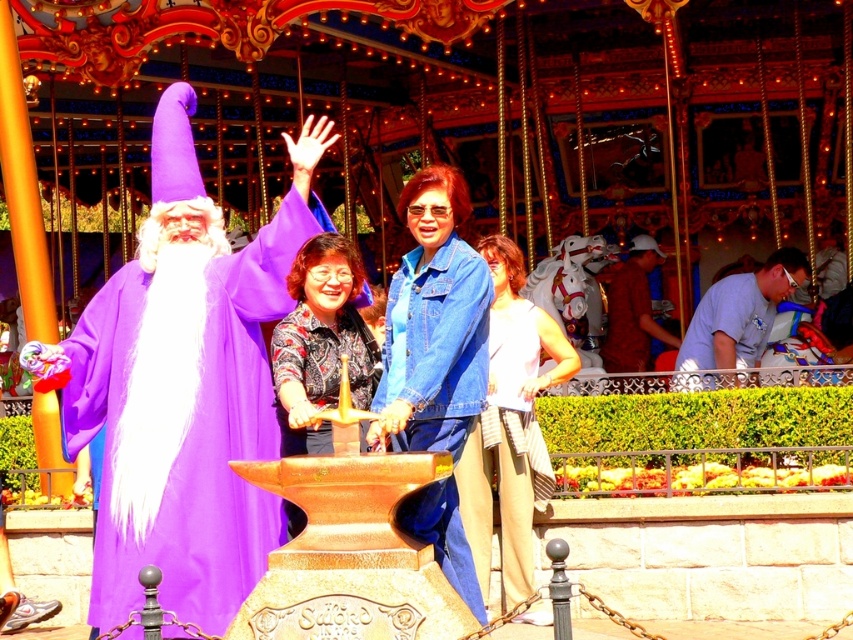
Is white cotton tank top at center further to camera compared to light blue denim shirt at right?

That is False.

Is point (490, 316) closer to viewer compared to point (767, 308)?

That is True.

Does point (531, 388) come closer to viewer compared to point (741, 324)?

Yes.

This screenshot has width=853, height=640. Find the location of `white cotton tank top at center`. white cotton tank top at center is located at coordinates (509, 426).

Can you confirm if denim jacket at center is positioned to the left of brown fabric shirt at center?

Indeed, denim jacket at center is positioned on the left side of brown fabric shirt at center.

Which is in front, point (430, 442) or point (647, 344)?

Point (430, 442)

What do you see at coordinates (433, 324) in the screenshot?
I see `denim jacket at center` at bounding box center [433, 324].

You are a GUI agent. You are given a task and a screenshot of the screen. Output one action in this format:
    pyautogui.click(x=<x>, y=<y>)
    Task: Click on the denim jacket at center
    This screenshot has height=640, width=853.
    Given the screenshot: What is the action you would take?
    pyautogui.click(x=433, y=324)

Which is behind, point (234, 388) or point (457, 273)?

Positioned behind is point (234, 388).

What do you see at coordinates (184, 385) in the screenshot? Image resolution: width=853 pixels, height=640 pixels. I see `purple velvet wizard at left` at bounding box center [184, 385].

The width and height of the screenshot is (853, 640). What do you see at coordinates (184, 385) in the screenshot? I see `purple velvet wizard at left` at bounding box center [184, 385].

Where is `purple velvet wizard at left`? The image size is (853, 640). purple velvet wizard at left is located at coordinates (184, 385).